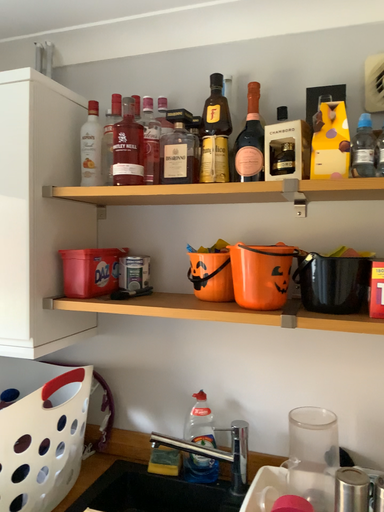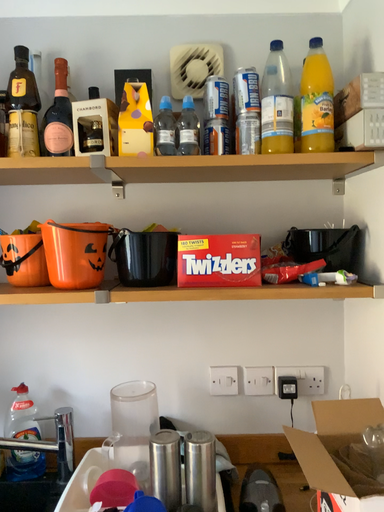
Question: Which way did the camera rotate in the video?

Choices:
 (A) rotated right
 (B) rotated left

Answer: (A)